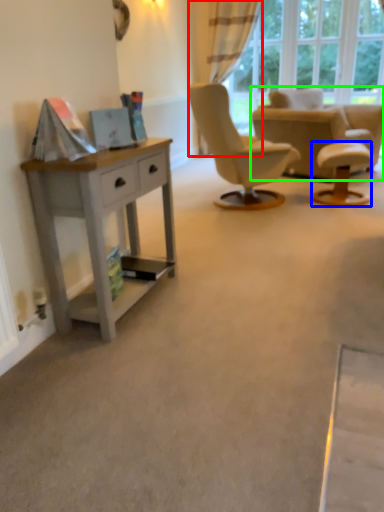
Question: Which is farther away from curtain (highlighted by a red box)? stool (highlighted by a blue box) or chair (highlighted by a green box)?

Choices:
 (A) stool
 (B) chair

Answer: (A)